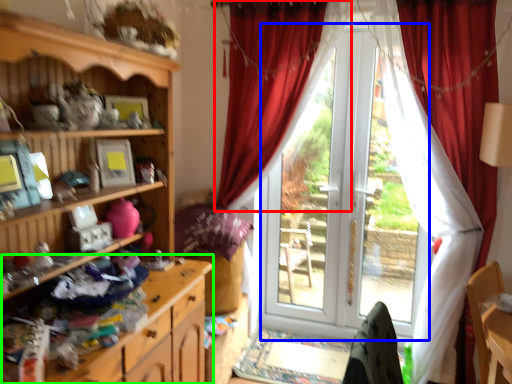
Question: Considering the real-world distances, which object is farthest from curtain (highlighted by a red box)? screen door (highlighted by a blue box) or cabinetry (highlighted by a green box)?

Choices:
 (A) screen door
 (B) cabinetry

Answer: (B)